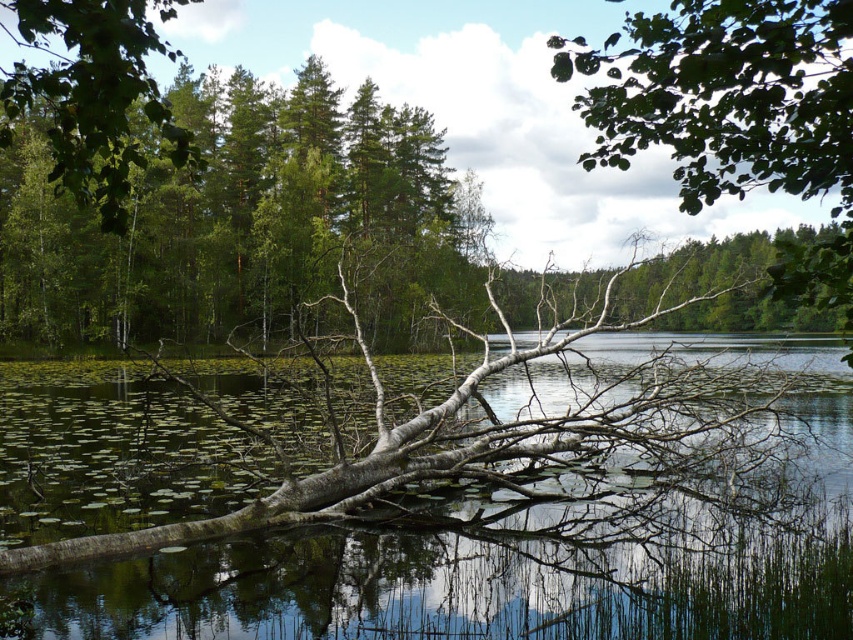
Question: Among these points, which one is farthest from the camera?

Choices:
 (A) (485, 586)
 (B) (254, 148)

Answer: (B)

Question: Can you confirm if transparent water at center is positioned below green matte tree at upper left?

Choices:
 (A) yes
 (B) no

Answer: (A)

Question: Considering the relative positions of transparent water at center and green matte tree at upper left in the image provided, where is transparent water at center located with respect to green matte tree at upper left?

Choices:
 (A) below
 (B) above

Answer: (A)

Question: Does transparent water at center have a smaller size compared to green matte tree at upper left?

Choices:
 (A) yes
 (B) no

Answer: (A)

Question: Among these points, which one is nearest to the camera?

Choices:
 (A) (70, 234)
 (B) (277, 566)

Answer: (B)